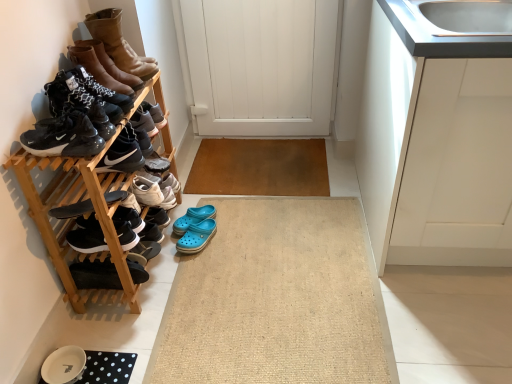
Question: Considering the positions of leather boots at upper left, which ranks as the eighth footwear in bottom-to-top order, and black suede shoe at lower left, the second shoe viewed from the top, in the image, is leather boots at upper left, which ranks as the eighth footwear in bottom-to-top order, wider or thinner than black suede shoe at lower left, the second shoe viewed from the top,?

Choices:
 (A) wide
 (B) thin

Answer: (A)

Question: Considering the positions of point (117, 49) and point (91, 218), is point (117, 49) closer or farther from the camera than point (91, 218)?

Choices:
 (A) farther
 (B) closer

Answer: (A)

Question: Based on their relative distances, which object is nearer to the beige woven bath mat at center?

Choices:
 (A) black suede shoe at lower left, the 1th shoe ordered from the bottom
 (B) black suede sneakers at left, the 6th footwear ordered from the bottom
 (C) blue rubber clogs at center, the seventh footwear positioned from the top
 (D) leather boots at upper left, which ranks as the eighth footwear in bottom-to-top order
 (E) white wooden door at center

Answer: (C)

Question: Which of these objects is positioned closest to the black suede sneakers at left, the 6th footwear ordered from the bottom?

Choices:
 (A) black suede sandal at lower left, which is the eighth footwear in top-to-bottom order
 (B) white wooden door at center
 (C) white matte cabinet at upper right
 (D) brown leather boots at upper left, marked as the 2th footwear in a top-to-bottom arrangement
 (E) black matte sneakers at upper left, which is the first shoe from top to bottom

Answer: (E)